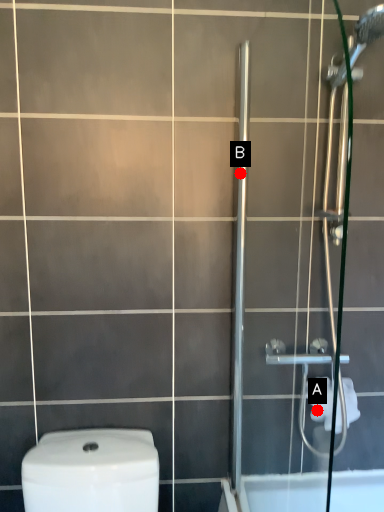
Question: Two points are circled on the image, labeled by A and B beside each circle. Which point is closer to the camera?

Choices:
 (A) A is closer
 (B) B is closer

Answer: (B)